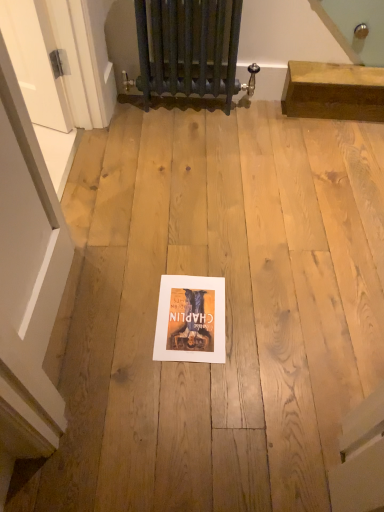
Locate an element on the screen. The width and height of the screenshot is (384, 512). free area behind matte paper postcard at center is located at coordinates (190, 247).